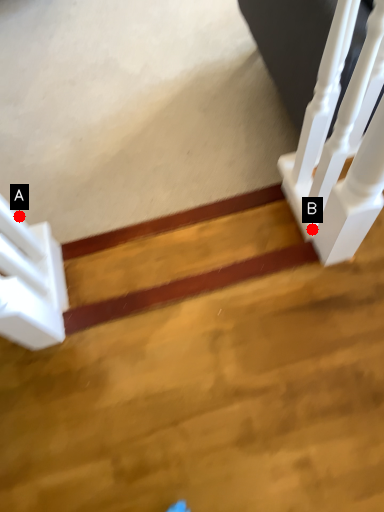
Question: Two points are circled on the image, labeled by A and B beside each circle. Which point is further to the camera?

Choices:
 (A) A is further
 (B) B is further

Answer: (A)